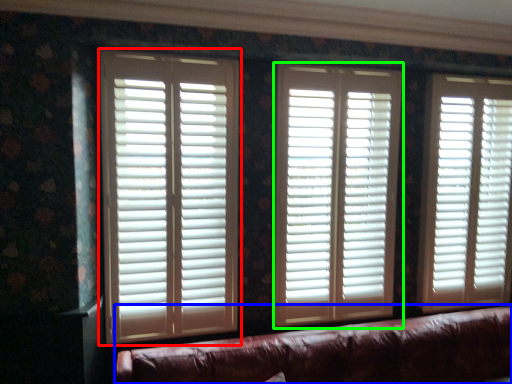
Question: Which is nearer to the window blind (highlighted by a red box)? studio couch (highlighted by a blue box) or window blind (highlighted by a green box).

Choices:
 (A) studio couch
 (B) window blind

Answer: (B)